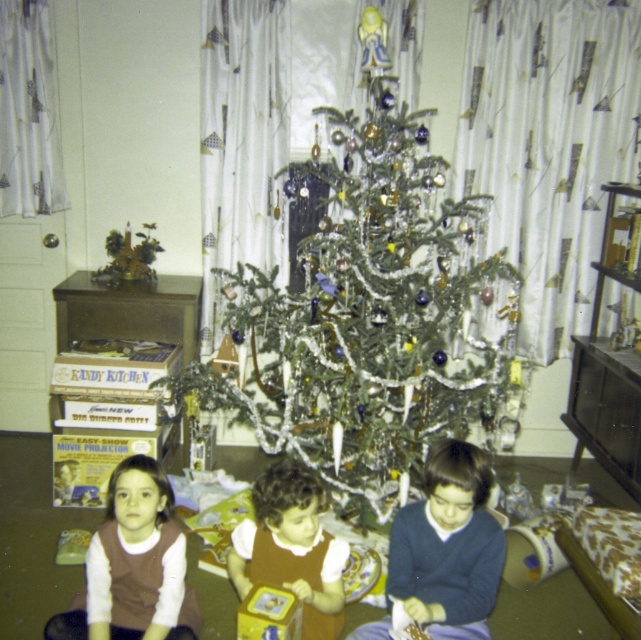
Question: Which point is farther from the camera taking this photo?

Choices:
 (A) (147, 509)
 (B) (279, 522)

Answer: (A)

Question: Among these objects, which one is farthest from the camera?

Choices:
 (A) green shiny tree at center
 (B) dark blue sweater at center
 (C) brown velvety shirt at lower left
 (D) brown velvet dress at center

Answer: (A)

Question: Does dark blue sweater at center have a larger size compared to brown velvety shirt at lower left?

Choices:
 (A) no
 (B) yes

Answer: (A)

Question: Observing the image, what is the correct spatial positioning of dark blue sweater at center in reference to brown velvet dress at center?

Choices:
 (A) right
 (B) left

Answer: (A)

Question: Which point is closer to the camera?

Choices:
 (A) dark blue sweater at center
 (B) brown velvet dress at center
 (C) brown velvety shirt at lower left
 (D) green shiny tree at center

Answer: (A)

Question: Is green shiny tree at center below brown velvety shirt at lower left?

Choices:
 (A) yes
 (B) no

Answer: (B)